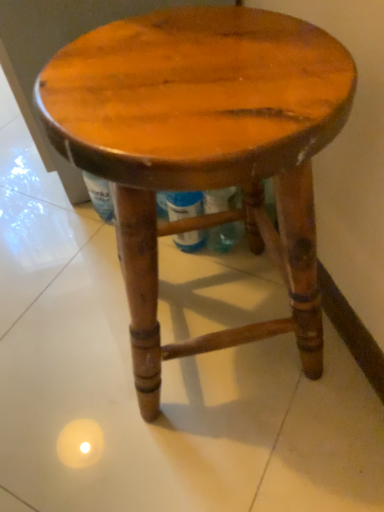
Identify the location of wooden stool at center. (203, 149).

Describe the element at coordinates (203, 149) in the screenshot. I see `wooden stool at center` at that location.

Measure the distance between point (127, 221) and camera.

They are 17.87 inches apart.

Locate an element on the screen. This screenshot has height=512, width=384. wooden stool at center is located at coordinates (203, 149).